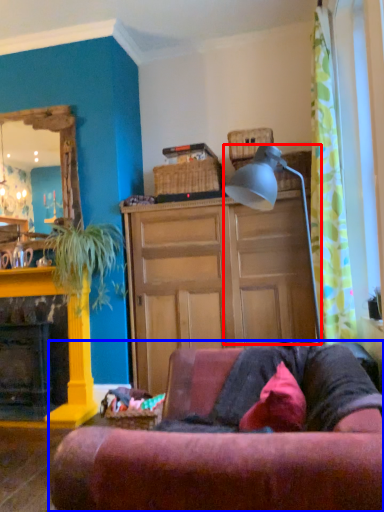
Question: Among these objects, which one is nearest to the camera, lamp (highlighted by a red box) or studio couch (highlighted by a blue box)?

Choices:
 (A) lamp
 (B) studio couch

Answer: (B)